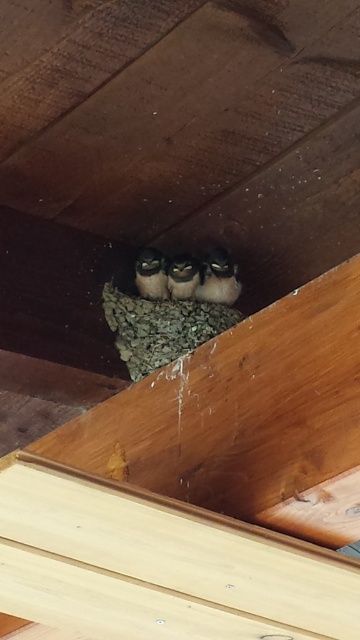
Can you confirm if gray mud nest at center is shorter than brown fuzzy nest at center?

Incorrect, gray mud nest at center's height does not fall short of brown fuzzy nest at center's.

Which is below, gray mud nest at center or brown fuzzy nest at center?

gray mud nest at center is below.

Find the location of a particular element. The height and width of the screenshot is (640, 360). gray mud nest at center is located at coordinates coord(160,326).

Is gray mud nest at center taller than brown fuzzy owl at center?

Yes.

Between point (162, 340) and point (180, 289), which one is positioned behind?

Point (180, 289)

Which is in front, point (123, 324) or point (200, 273)?

Point (123, 324) is more forward.

Locate an element on the screen. The width and height of the screenshot is (360, 640). gray mud nest at center is located at coordinates (160, 326).

Which is more to the right, gray mud nest at center or brown fuzzy bird at center?

From the viewer's perspective, brown fuzzy bird at center appears more on the right side.

Where is `gray mud nest at center`? The height and width of the screenshot is (640, 360). gray mud nest at center is located at coordinates (160, 326).

Does point (204, 314) lie behind point (226, 272)?

That is False.

At what (x,y) coordinates should I click in order to perform the action: click on gray mud nest at center. Please return your answer as a coordinate pair (x, y). Looking at the image, I should click on (160, 326).